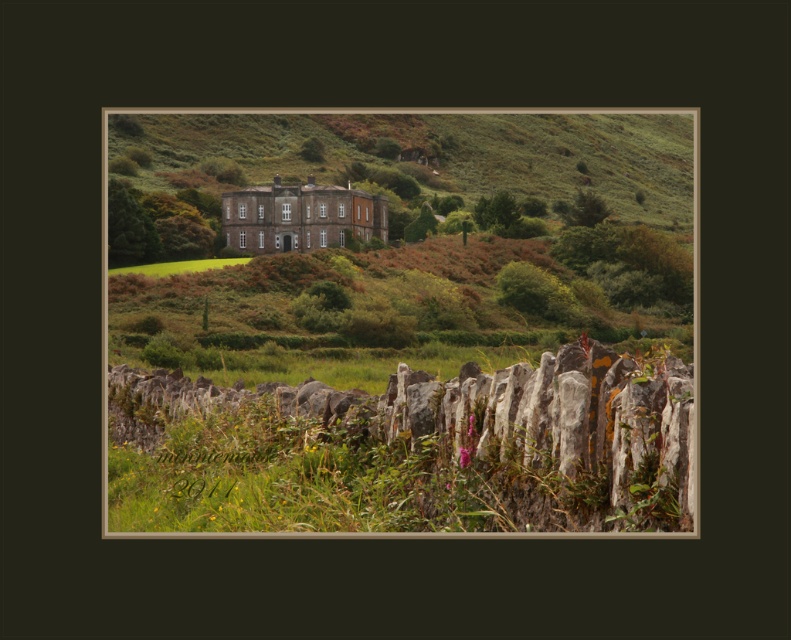
Is gray stone fence at lower center closer to the viewer compared to green grass at center?

Yes, it is in front of green grass at center.

The width and height of the screenshot is (791, 640). I want to click on gray stone fence at lower center, so click(411, 449).

Find the location of `gray stone fence at lower center`. gray stone fence at lower center is located at coordinates (411, 449).

I want to click on gray stone fence at lower center, so click(x=411, y=449).